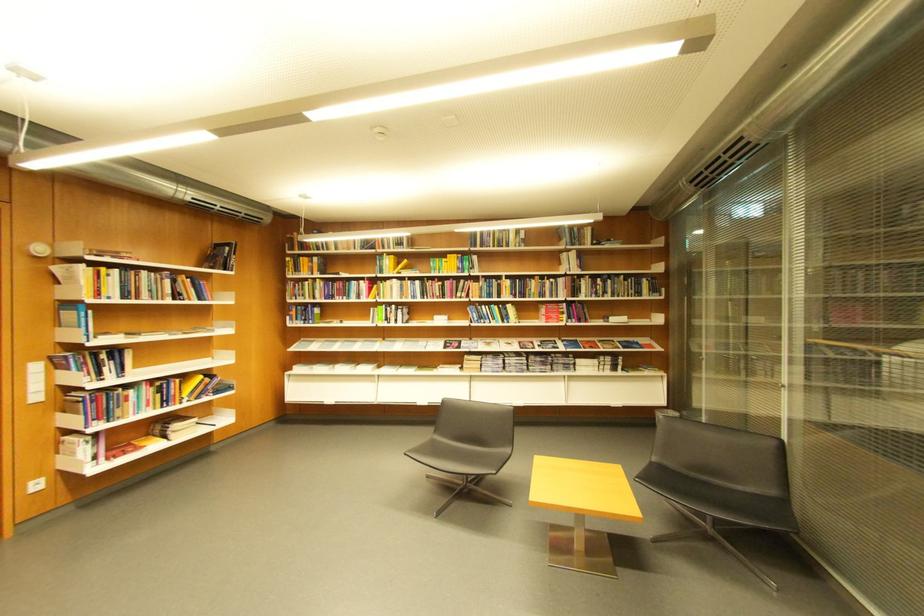
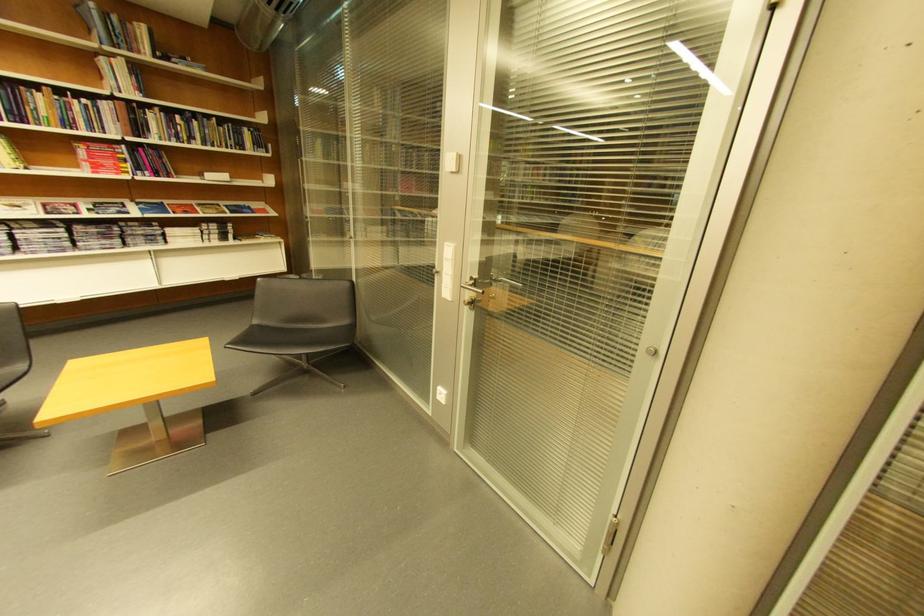
Question: I am providing you with two images of the same scene from different viewpoints. After the viewpoint changes to image2, which objects are now occluded?

Choices:
 (A) book on shelf
 (B) black chair sitting surface
 (C) silver door handle
 (D) none of these

Answer: (D)